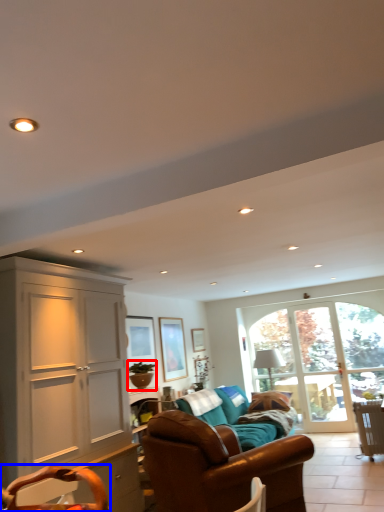
Question: Which object appears farthest to the camera in this image, houseplant (highlighted by a red box) or swivel chair (highlighted by a blue box)?

Choices:
 (A) houseplant
 (B) swivel chair

Answer: (A)